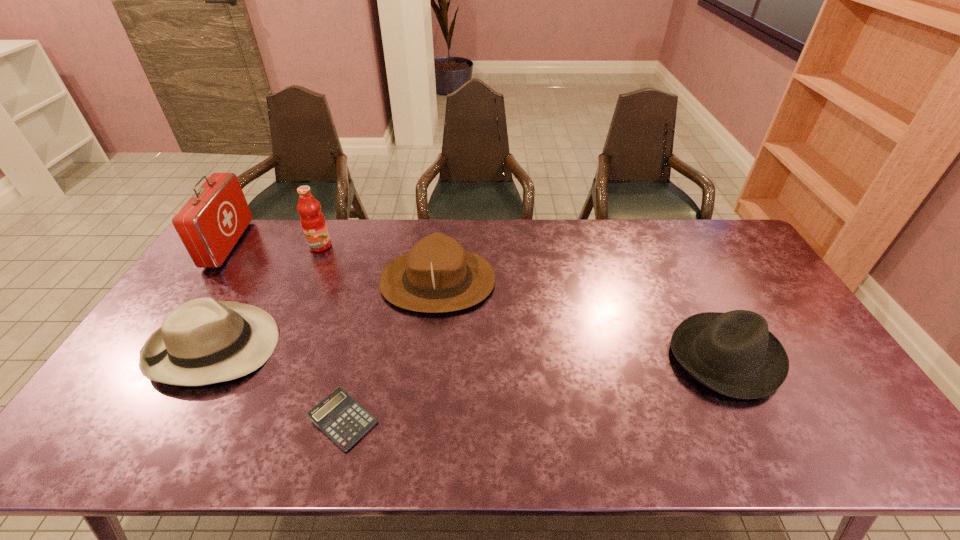
Image resolution: width=960 pixels, height=540 pixels. I want to click on free space located 0.110m on the front-facing side of the leftmost fedora, so click(316, 347).

What are the coordinates of `blank space located 0.130m on the back of the rightmost object` in the screenshot? It's located at (690, 286).

Identify the location of vacant space located on the back of the shortest object. (372, 307).

This screenshot has width=960, height=540. I want to click on the first-aid kit situated at the far edge, so click(x=211, y=222).

This screenshot has width=960, height=540. Identify the location of fruit juice at the far edge. (313, 222).

Identify the location of fedora that is positioned at the far edge. (437, 275).

Identify the location of object that is at the near edge. (339, 416).

Where is `the first-aid kit at the left edge`? Image resolution: width=960 pixels, height=540 pixels. the first-aid kit at the left edge is located at coordinates (211, 222).

Find the location of a particular element. This screenshot has height=540, width=960. fedora that is at the left edge is located at coordinates (202, 342).

This screenshot has height=540, width=960. I want to click on object at the right edge, so click(734, 353).